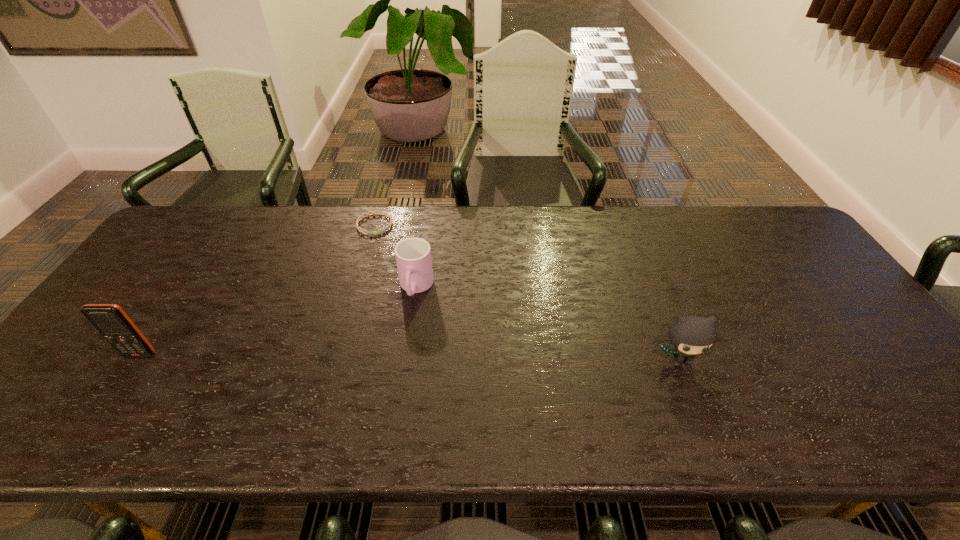
Find the location of a particular element. The image size is (960, 540). vacant space on the desktop that is between the leftmost object and the rightmost object and is positioned on the surface of the bracelet showing star-shaped elements is located at coordinates (456, 357).

Find the location of a particular element. The image size is (960, 540). free space on the desktop that is between the leftmost object and the kitten and is positioned with the handle on the side of the cup is located at coordinates (398, 357).